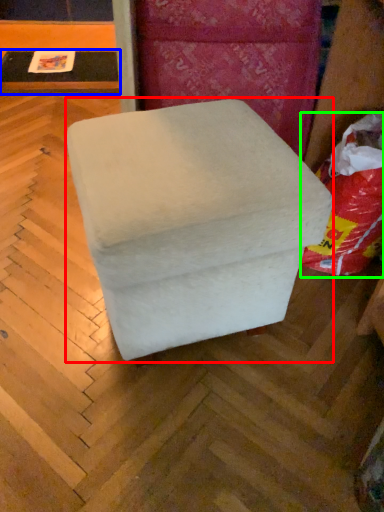
Question: Estimate the real-world distances between objects in this image. Which object is closer to furniture (highlighted by a red box), table (highlighted by a blue box) or bean bag chair (highlighted by a green box)?

Choices:
 (A) table
 (B) bean bag chair

Answer: (B)